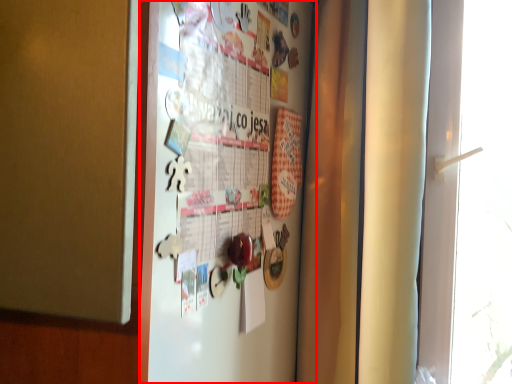
Question: From the image's perspective, what is the correct spatial relationship of fridge (annotated by the red box) in relation to window?

Choices:
 (A) above
 (B) below

Answer: (A)